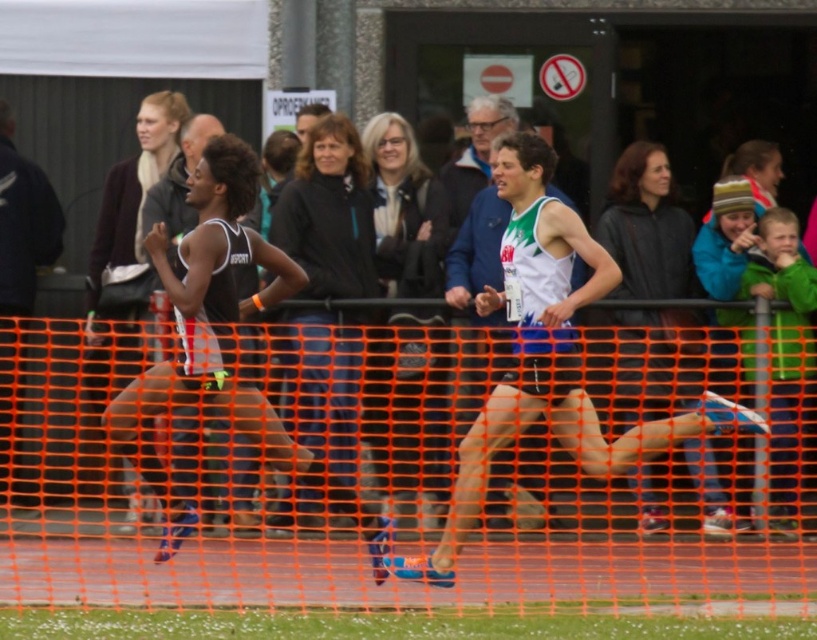
Question: Does orange mesh fence at center have a larger size compared to matte black tank top at left?

Choices:
 (A) no
 (B) yes

Answer: (B)

Question: Is matte black tank top at left to the right of white jersey at center from the viewer's perspective?

Choices:
 (A) yes
 (B) no

Answer: (B)

Question: Which point is closer to the camera taking this photo?

Choices:
 (A) (521, 218)
 (B) (195, 372)

Answer: (B)

Question: In this image, where is orange mesh fence at center located relative to matte black tank top at left?

Choices:
 (A) right
 (B) left

Answer: (B)

Question: Which object appears closest to the camera in this image?

Choices:
 (A) white jersey at center
 (B) white fabric tank top at center

Answer: (B)

Question: Which point is farther to the camera?

Choices:
 (A) (490, 244)
 (B) (243, 356)

Answer: (A)